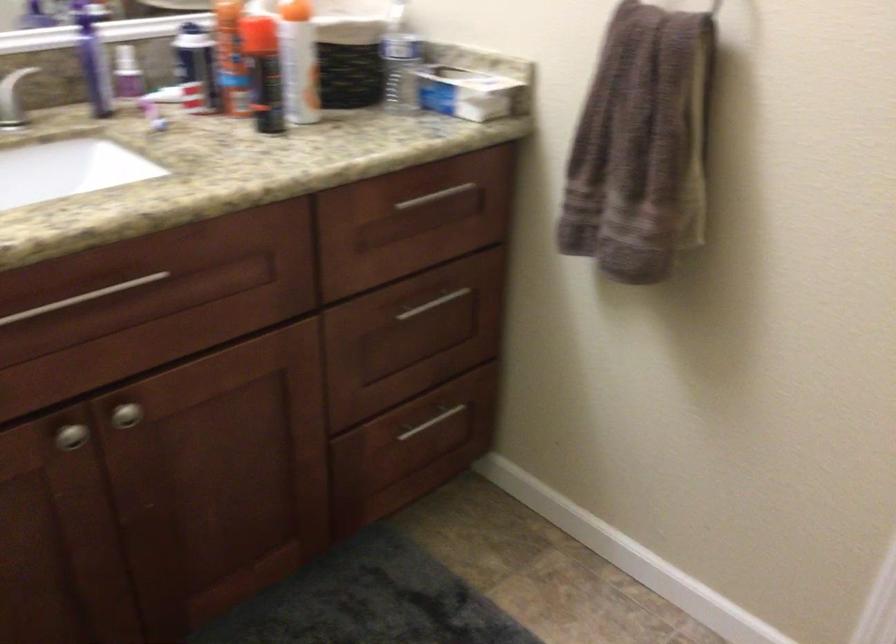
Which object does [470,91] point to?

It refers to a tissue box.